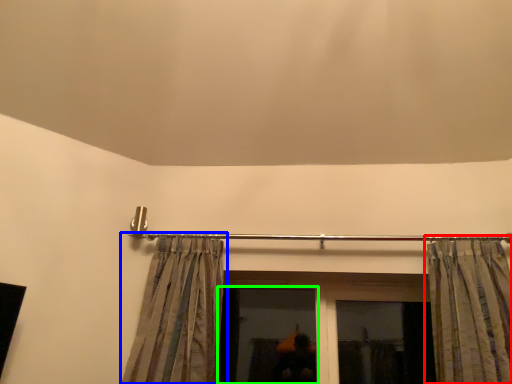
Question: Which object is positioned farthest from curtain (highlighted by a red box)? Select from curtain (highlighted by a blue box) and window (highlighted by a green box).

Choices:
 (A) curtain
 (B) window

Answer: (A)